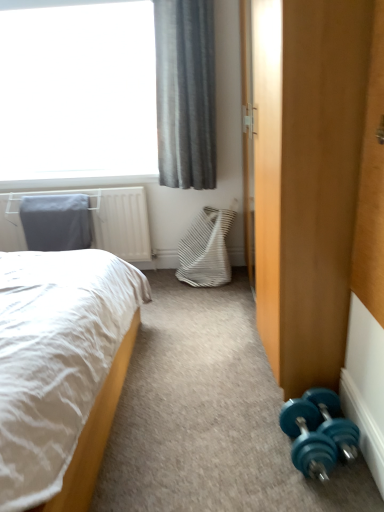
Question: From a real-world perspective, is teal rubber dumbbell at lower right, which ranks as the 1th dumbbell in left-to-right order, positioned above or below white soft bed at left?

Choices:
 (A) below
 (B) above

Answer: (A)

Question: Is teal rubber dumbbell at lower right, the second dumbbell positioned from the right, bigger or smaller than white soft bed at left?

Choices:
 (A) big
 (B) small

Answer: (B)

Question: Which of these objects is positioned closest to the gray fabric pillow at upper left?

Choices:
 (A) teal rubber dumbbell at lower right, which appears as the second dumbbell when viewed from the left
 (B) wooden wardrobe at lower right
 (C) teal rubber dumbbell at lower right, the second dumbbell positioned from the right
 (D) gray fabric curtain at upper left
 (E) white woven swivel chair at center

Answer: (E)

Question: Which is nearer to the white woven swivel chair at center?

Choices:
 (A) gray fabric pillow at upper left
 (B) gray fabric curtain at upper left
 (C) wooden wardrobe at lower right
 (D) teal rubber dumbbell at lower right, arranged as the first dumbbell when viewed from the right
 (E) teal rubber dumbbell at lower right, which ranks as the 1th dumbbell in left-to-right order

Answer: (B)